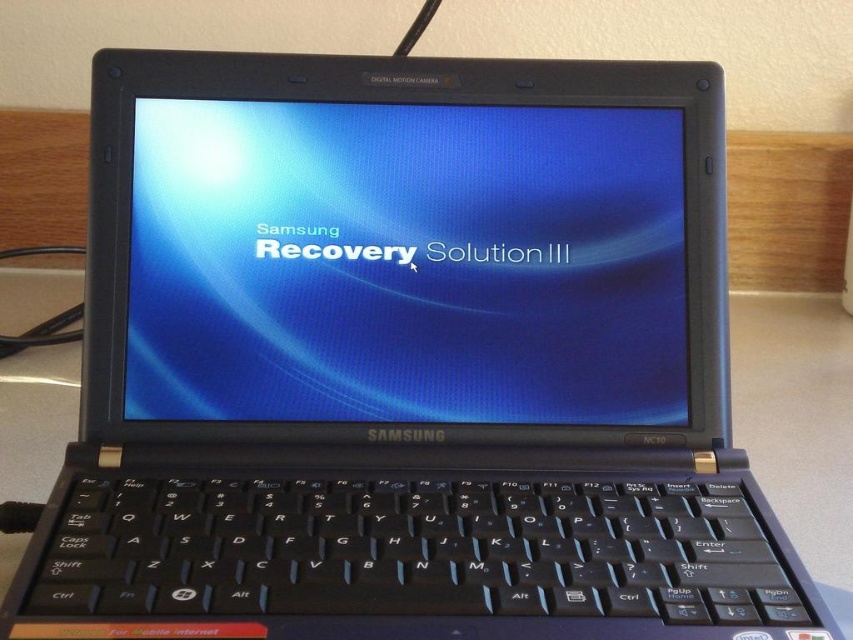
You are sitting in front of the Samsung laptop and want to locate two points on its keyboard. The first point is at coordinates point (515,387) and the second is at point (119,593). Which point is closer to you?

Point (515,387) is further to the viewer than point (119,593), so point (119,593) is closer to you.

You are setting up a new workspace and have both the blue glossy screen at center and the black plastic keyboard at center. Which object takes up more space in your workspace?

The blue glossy screen at center is larger in size than the black plastic keyboard at center, so it takes up more space in the workspace.

You are positioning a new monitor stand in front of the Samsung laptop. The stand has a sensor that detects the center point of the blue glossy screen at center. What are the coordinates where the stand should be placed to align with the screen?

The blue glossy screen at center is located at point (405, 262), so the stand should be placed at those coordinates to align with the screen.